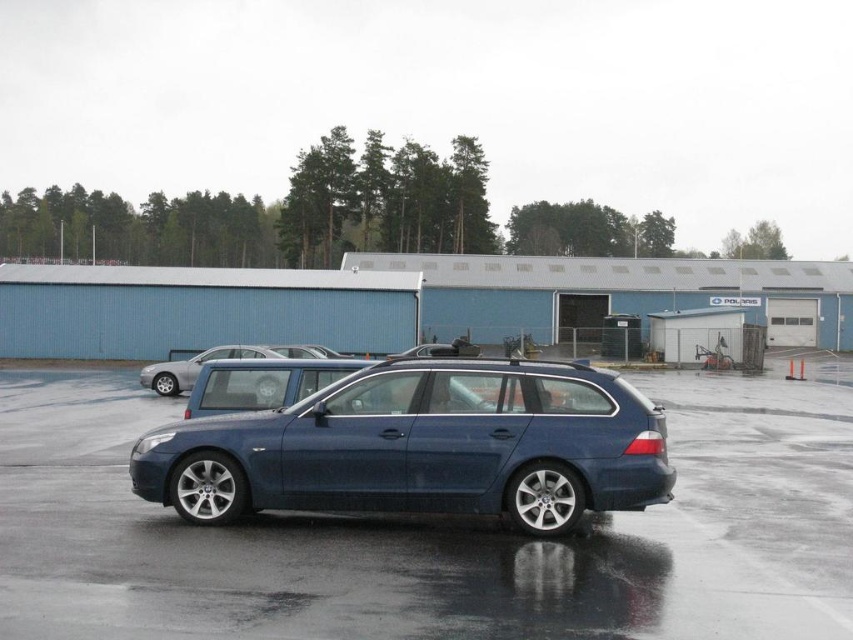
Looking at this image, you are a delivery driver who needs to back out of the parking spot between the metallic blue car at center and the satin blue wagon at center. Which vehicle should you move around to exit safely?

The metallic blue car at center is in front of the satin blue wagon at center, so you should move around the satin blue wagon at center to exit safely since it is behind the metallic blue car at center.

You are a parking attendant who needs to direct a new vehicle to park between the metallic blue car at center and the satin blue wagon at center. Based on the scene, is there enough space between them for a standard compact car? Please explain your reasoning.

The metallic blue car at center is positioned on the left side of the satin blue wagon at center. Since the two vehicles are parked next to each other with the metallic blue car on the left and the satin blue wagon on the right, there is likely sufficient space between them for a standard compact car to fit in between.